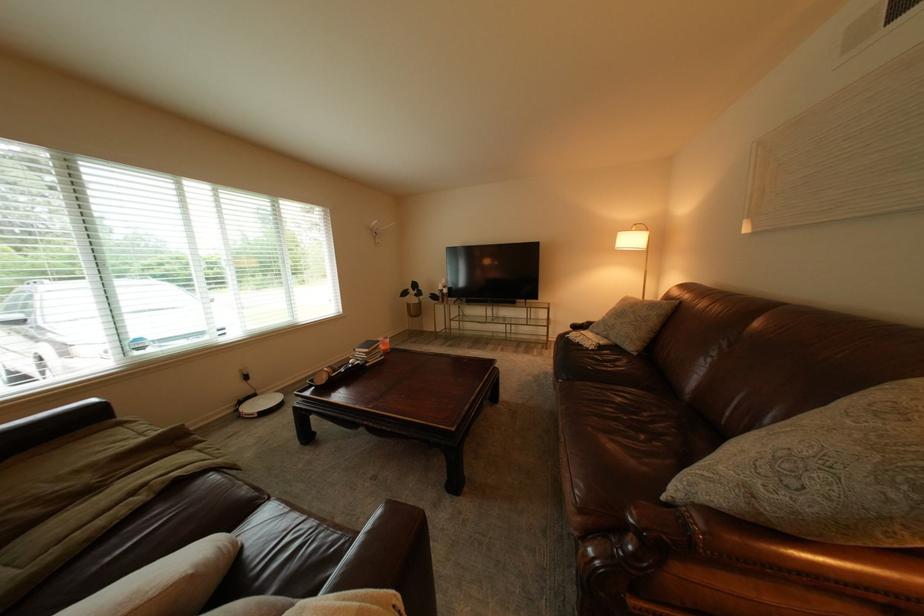
Where would you sit the sofa sitting surface? Please return your answer as a coordinate pair (x, y).

(112, 501)